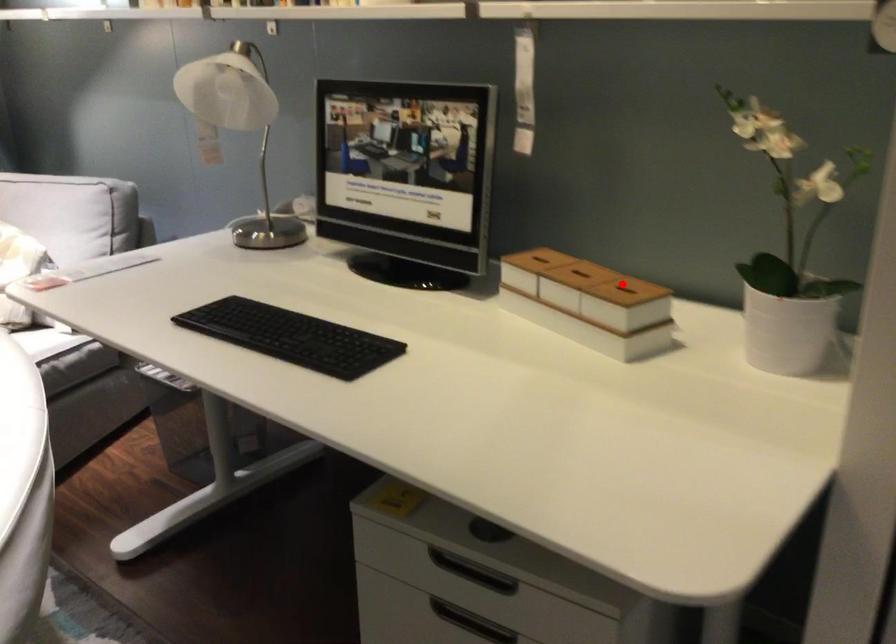
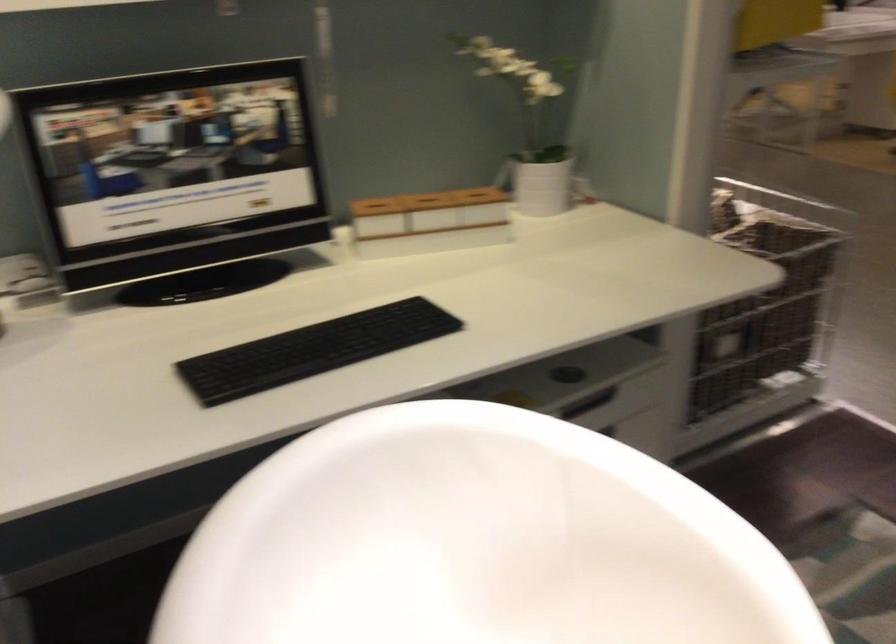
Question: I am providing you with two images of the same scene from different viewpoints. A red point is shown in image1. For the corresponding object point in image2, is it positioned nearer or farther from the camera?

Choices:
 (A) Nearer
 (B) Farther

Answer: (B)